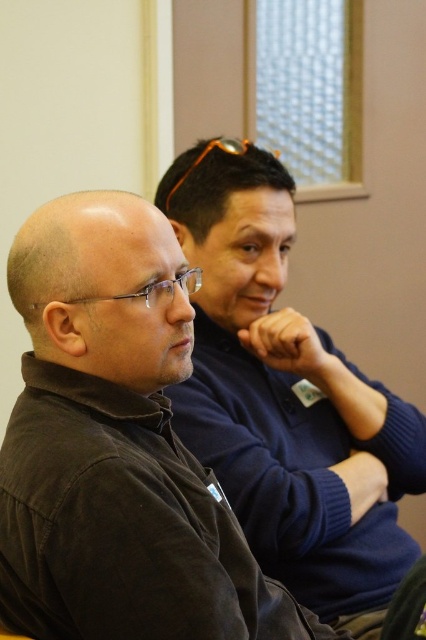
You are standing in the conference room and want to reach the point marked at coordinates point (123, 317). If your arm length is 28 inches, can you reach it without moving your feet?

The point marked at coordinates point (123, 317) is 39.11 inches away from you. Since your arm length is only 28 inches, you cannot reach it without moving your feet.

You are organizing a photoshoot and need to arrange the black matte jacket at left and the navy blue sweater at center according to their positions in the image. Which object should be placed first from the left when setting up the scene?

The black matte jacket at left should be placed first from the left since it is positioned to the left of the navy blue sweater at center in the image.